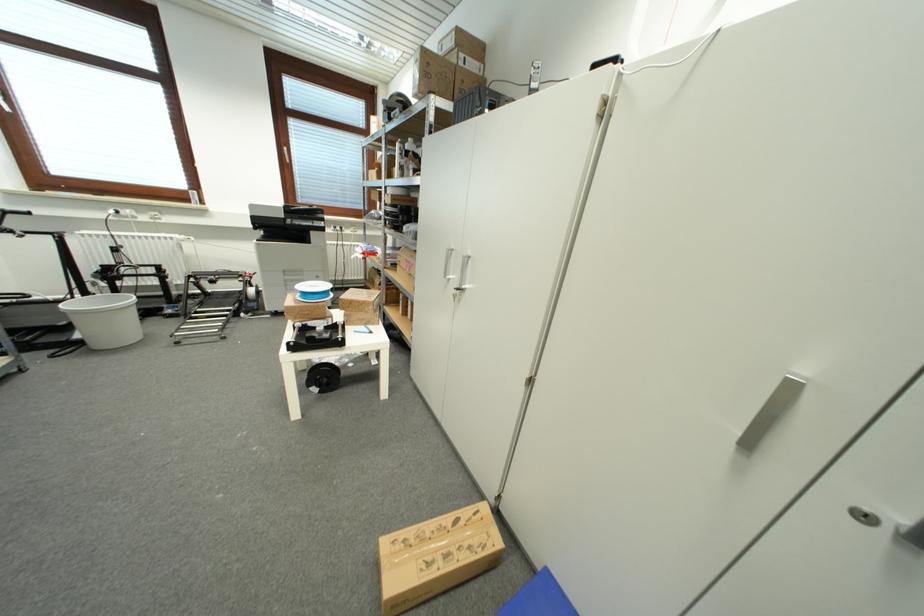
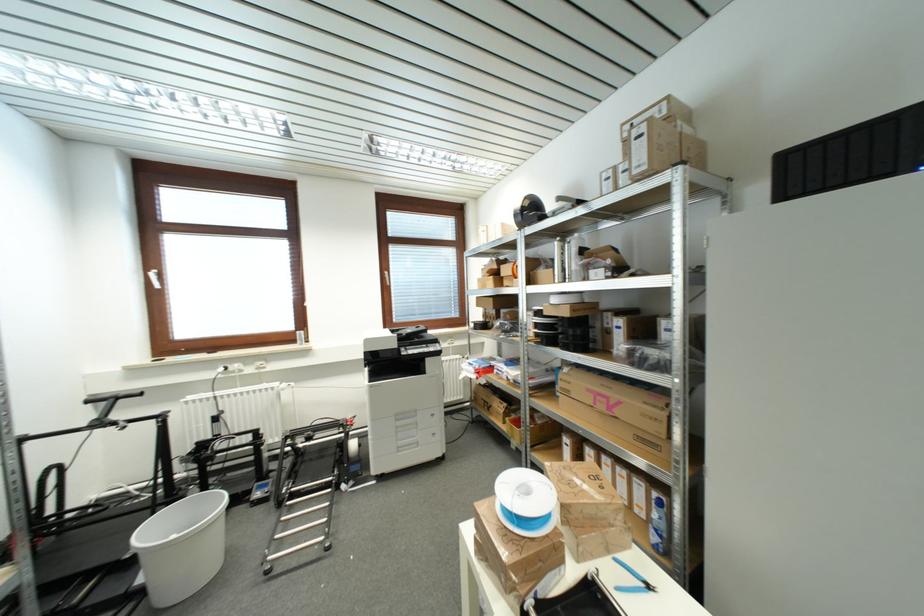
The point at (80, 339) is marked in the first image. Where is the corresponding point in the second image?

(144, 582)